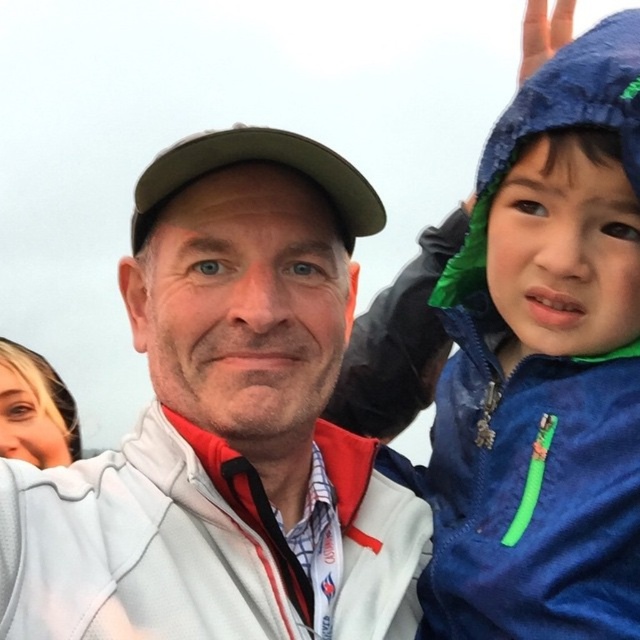
Question: Does white fleece jacket at center have a greater width compared to blue fleece jacket at upper right?

Choices:
 (A) yes
 (B) no

Answer: (A)

Question: Is white fleece jacket at center below blue fleece jacket at upper right?

Choices:
 (A) no
 (B) yes

Answer: (B)

Question: Among these points, which one is farthest from the camera?

Choices:
 (A) (593, 611)
 (B) (68, 572)

Answer: (B)

Question: Which point is closer to the camera?

Choices:
 (A) white fleece jacket at center
 (B) blue fleece jacket at upper right

Answer: (B)

Question: Where is white fleece jacket at center located in relation to blue fleece jacket at upper right in the image?

Choices:
 (A) below
 (B) above

Answer: (A)